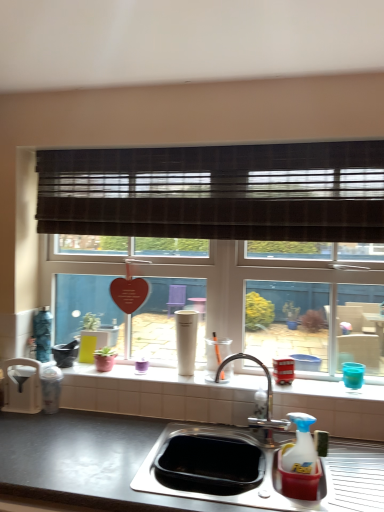
Locate an element on the screen. Image resolution: width=384 pixels, height=512 pixels. free region on the left part of metallic red bus at right, positioned as the fourth appliance in left-to-right order is located at coordinates (258, 380).